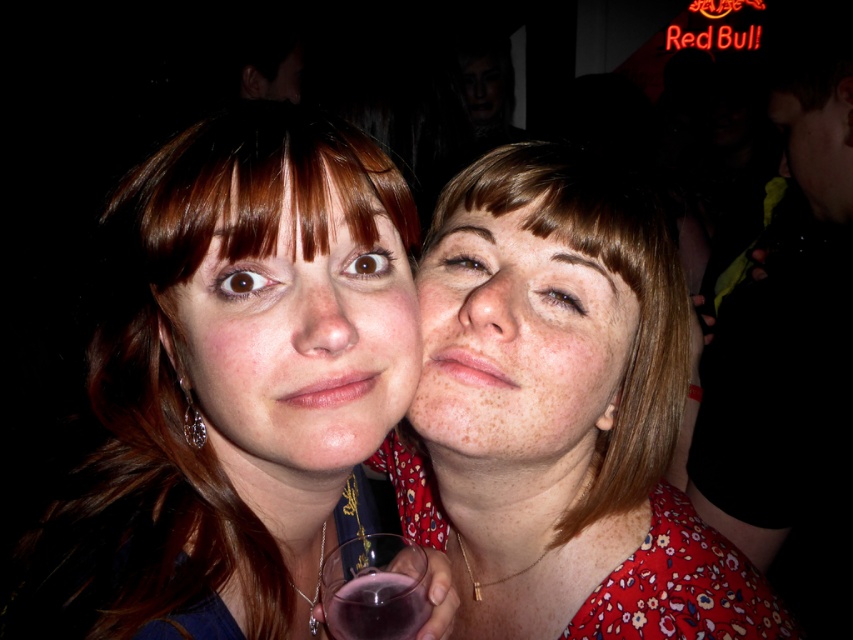
Question: Which point is farther to the camera?

Choices:
 (A) (618, 392)
 (B) (196, 131)
 (C) (463, 321)
 (D) (219, 148)

Answer: (A)

Question: Based on their relative distances, which object is nearer to the brown matte hair at center?

Choices:
 (A) dry skin nose at center
 (B) translucent glass at center

Answer: (A)

Question: Can you confirm if floral fabric dress at center is positioned below matte skin face at center?

Choices:
 (A) yes
 (B) no

Answer: (A)

Question: Can you confirm if transparent glass at center is positioned above dry skin nose at center?

Choices:
 (A) yes
 (B) no

Answer: (B)

Question: In this image, where is matte skin face at center located relative to freckled skin at center?

Choices:
 (A) above
 (B) below

Answer: (A)

Question: Which point is farther to the camera?

Choices:
 (A) freckled skin at center
 (B) matte blue shirt at center
 (C) floral fabric dress at center

Answer: (C)